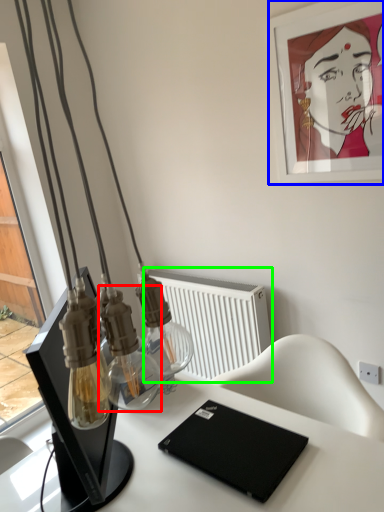
Question: Considering the real-world distances, which object is closest to bottle (highlighted by a red box)? picture frame (highlighted by a blue box) or radiator (highlighted by a green box).

Choices:
 (A) picture frame
 (B) radiator

Answer: (B)